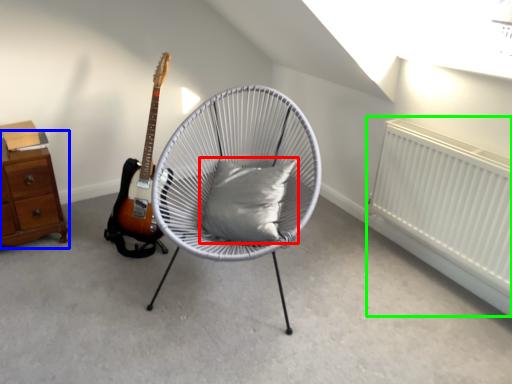
Question: Estimate the real-world distances between objects in this image. Which object is farther from pillow (highlighted by a red box), chest of drawers (highlighted by a blue box) or radiator (highlighted by a green box)?

Choices:
 (A) chest of drawers
 (B) radiator

Answer: (A)